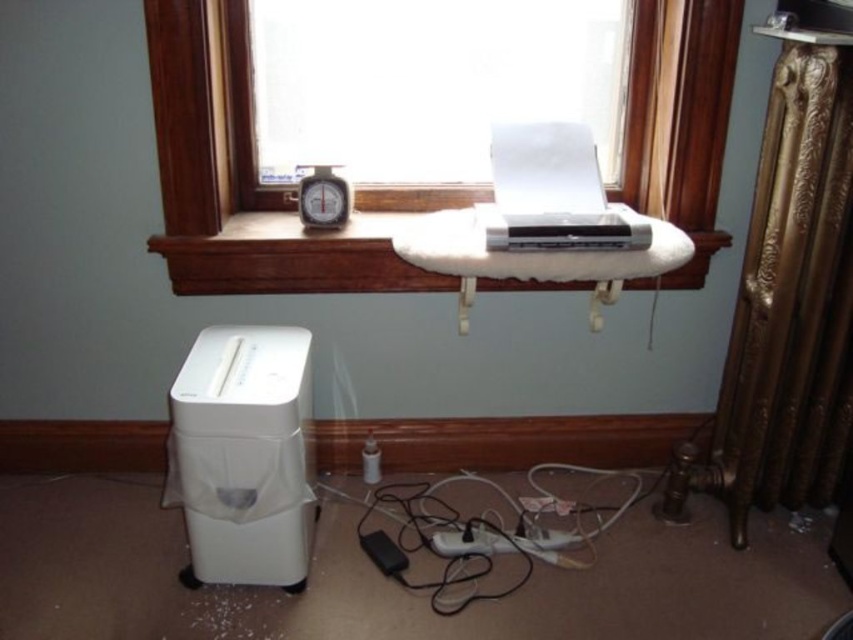
Does black plastic plug at lower center appear on the right side of black plastic alarm clock at center?

Indeed, black plastic plug at lower center is positioned on the right side of black plastic alarm clock at center.

Can you confirm if black plastic plug at lower center is thinner than black plastic alarm clock at center?

No.

Between point (532, 541) and point (316, 195), which one is positioned in front?

Positioned in front is point (532, 541).

I want to click on black plastic plug at lower center, so click(x=498, y=540).

Is white plastic shredder at lower left bigger than black plastic plug at lower center?

Yes, white plastic shredder at lower left is bigger than black plastic plug at lower center.

Who is more distant from viewer, (279, 396) or (503, 536)?

The point (503, 536) is behind.

This screenshot has height=640, width=853. I want to click on white plastic shredder at lower left, so click(242, 454).

Who is positioned more to the left, transparent glass window at center or black plastic alarm clock at center?

Positioned to the left is black plastic alarm clock at center.

Does transparent glass window at center have a lesser width compared to black plastic alarm clock at center?

In fact, transparent glass window at center might be wider than black plastic alarm clock at center.

The width and height of the screenshot is (853, 640). I want to click on transparent glass window at center, so click(418, 88).